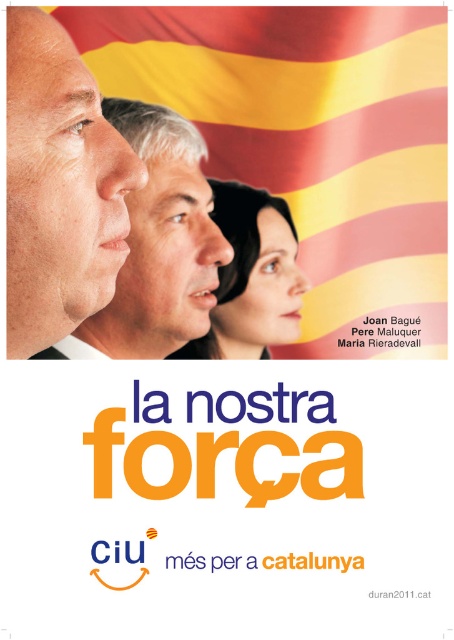
Who is shorter, smooth skin face at upper center or smooth skin face at center?

smooth skin face at center is shorter.

Who is taller, smooth skin face at upper center or smooth skin face at center?

Standing taller between the two is smooth skin face at upper center.

Find the location of `smooth skin face at upper center`. smooth skin face at upper center is located at coordinates (157, 244).

Consider the image. Does orange glossy text at upper center appear over smooth skin face at upper center?

No, orange glossy text at upper center is not above smooth skin face at upper center.

Based on the photo, between orange glossy text at upper center and smooth skin face at upper center, which one has less height?

Standing shorter between the two is orange glossy text at upper center.

What do you see at coordinates (227, 509) in the screenshot?
I see `orange glossy text at upper center` at bounding box center [227, 509].

Identify the location of orange glossy text at upper center. The height and width of the screenshot is (640, 454). (227, 509).

Between orange glossy text at upper center and smooth skin face at center, which one has more height?

With more height is orange glossy text at upper center.

Does orange glossy text at upper center have a greater height compared to smooth skin face at center?

Yes, orange glossy text at upper center is taller than smooth skin face at center.

Find the location of a particular element. orange glossy text at upper center is located at coordinates tap(227, 509).

Image resolution: width=454 pixels, height=640 pixels. I want to click on orange glossy text at upper center, so click(227, 509).